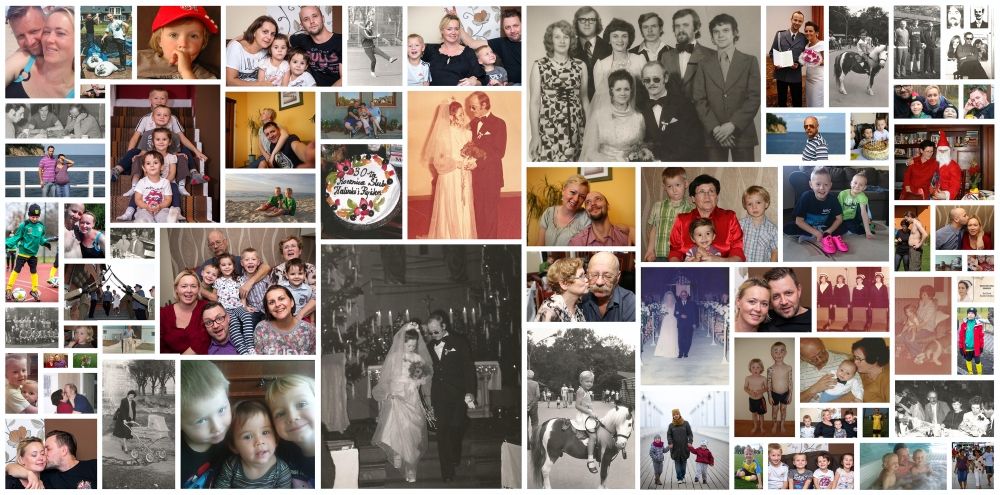
You are a GUI agent. You are given a task and a screenshot of the screen. Output one action in this format:
    pyautogui.click(x=<x>, y=<y>)
    Task: Click on the pictures on the right side of the image
    This screenshot has width=1000, height=495.
    Given the screenshot: What is the action you would take?
    pyautogui.click(x=985, y=23), pyautogui.click(x=985, y=105), pyautogui.click(x=979, y=149), pyautogui.click(x=983, y=221), pyautogui.click(x=983, y=258), pyautogui.click(x=984, y=290), pyautogui.click(x=988, y=327), pyautogui.click(x=975, y=394), pyautogui.click(x=974, y=463)